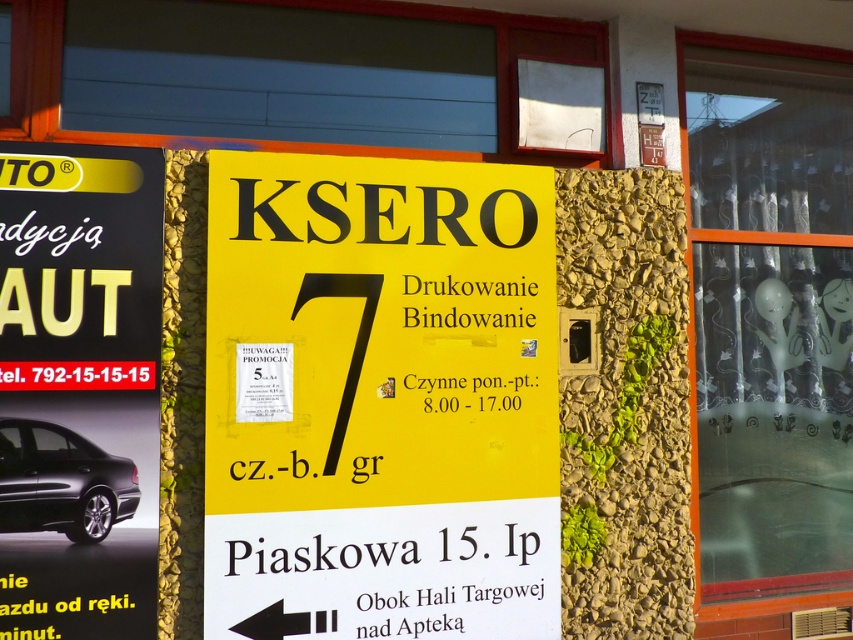
Which is more to the left, yellow paper sign at center or transparent glass window at center?

yellow paper sign at center is more to the left.

Who is positioned more to the right, yellow paper sign at center or transparent glass window at center?

transparent glass window at center

Is point (527, 196) behind point (850, 346)?

No, (527, 196) is in front of (850, 346).

Where is `yellow paper sign at center`? This screenshot has height=640, width=853. yellow paper sign at center is located at coordinates (380, 400).

Can you confirm if transparent glass window at center is shorter than black glossy car at left?

In fact, transparent glass window at center may be taller than black glossy car at left.

Does transparent glass window at center lie behind black glossy car at left?

Yes, it is.

Is point (741, 573) closer to camera compared to point (51, 257)?

No, (741, 573) is behind (51, 257).

Identify the location of transparent glass window at center. The height and width of the screenshot is (640, 853). (769, 310).

What do you see at coordinates (79, 266) in the screenshot? Image resolution: width=853 pixels, height=640 pixels. I see `yellow matte sign at left` at bounding box center [79, 266].

Which of these two, yellow matte sign at left or shiny black car at left, stands shorter?

With less height is shiny black car at left.

Measure the distance between point (55, 355) and camera.

Point (55, 355) and camera are 4.18 meters apart from each other.

Identify the location of yellow matte sign at left. (79, 266).